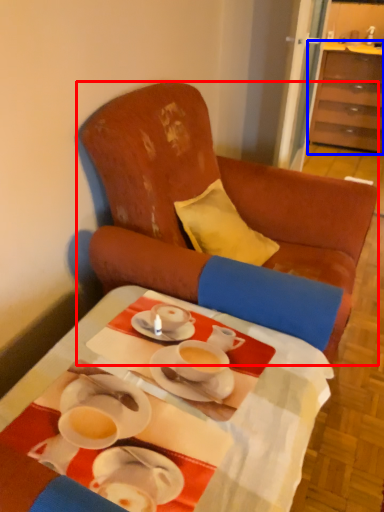
Question: Among these objects, which one is farthest to the camera, chair (highlighted by a red box) or cabinetry (highlighted by a blue box)?

Choices:
 (A) chair
 (B) cabinetry

Answer: (B)